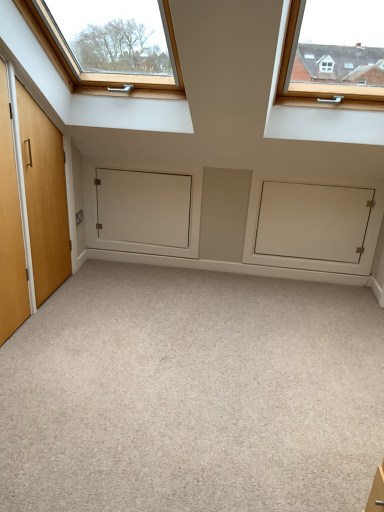
Question: Considering the relative positions of carpet at center and white matte door at center in the image provided, is carpet at center in front of white matte door at center?

Choices:
 (A) yes
 (B) no

Answer: (A)

Question: From a real-world perspective, is carpet at center located beneath white matte door at center?

Choices:
 (A) no
 (B) yes

Answer: (B)

Question: Is carpet at center thinner than white matte door at center?

Choices:
 (A) no
 (B) yes

Answer: (A)

Question: Is white matte door at center surrounded by carpet at center?

Choices:
 (A) yes
 (B) no

Answer: (B)

Question: Is carpet at center taller than white matte door at center?

Choices:
 (A) no
 (B) yes

Answer: (A)

Question: Considering the relative positions of carpet at center and white matte cabinet at center in the image provided, is carpet at center to the left or to the right of white matte cabinet at center?

Choices:
 (A) left
 (B) right

Answer: (A)

Question: Considering their positions, is carpet at center located in front of or behind white matte cabinet at center?

Choices:
 (A) front
 (B) behind

Answer: (A)

Question: Does point (177, 371) appear closer or farther from the camera than point (292, 199)?

Choices:
 (A) farther
 (B) closer

Answer: (B)

Question: Is carpet at center bigger or smaller than white matte cabinet at center?

Choices:
 (A) small
 (B) big

Answer: (B)

Question: Looking at their shapes, would you say white matte door at center is wider or thinner than white matte cabinet at center?

Choices:
 (A) thin
 (B) wide

Answer: (A)

Question: In terms of size, does white matte door at center appear bigger or smaller than white matte cabinet at center?

Choices:
 (A) big
 (B) small

Answer: (B)

Question: Considering their positions, is white matte door at center located in front of or behind white matte cabinet at center?

Choices:
 (A) front
 (B) behind

Answer: (B)

Question: From a real-world perspective, is white matte door at center positioned above or below white matte cabinet at center?

Choices:
 (A) below
 (B) above

Answer: (B)

Question: In terms of size, does white matte cabinet at center appear bigger or smaller than white matte door at center?

Choices:
 (A) small
 (B) big

Answer: (B)

Question: From the image's perspective, is white matte cabinet at center positioned above or below white matte door at center?

Choices:
 (A) below
 (B) above

Answer: (A)